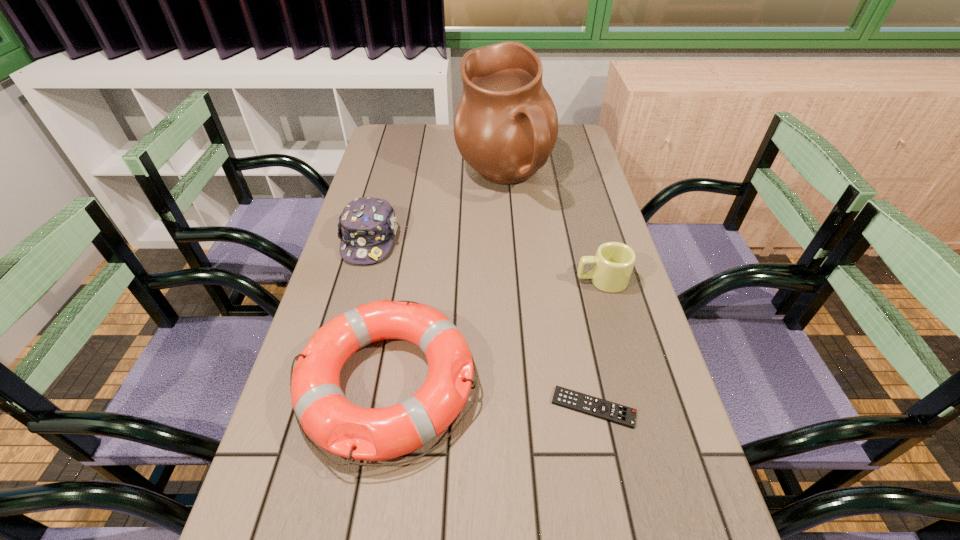
This screenshot has height=540, width=960. In order to click on vacant space that's between the life buoy and the mug in this screenshot , I will do `click(494, 332)`.

The image size is (960, 540). I want to click on vacant area that lies between the remote control and the life buoy, so click(x=490, y=395).

Find the location of a particular element. This screenshot has height=540, width=960. free spot between the mug and the headwear is located at coordinates (486, 260).

I want to click on blank region between the cream pitcher and the headwear, so click(437, 210).

Point out which object is positioned as the third nearest to the life buoy. Please provide its 2D coordinates. Your answer should be formatted as a tuple, i.e. [(x, y)], where the tuple contains the x and y coordinates of a point satisfying the conditions above.

[(613, 263)]

Locate which object ranks fourth in proximity to the headwear. Please provide its 2D coordinates. Your answer should be formatted as a tuple, i.e. [(x, y)], where the tuple contains the x and y coordinates of a point satisfying the conditions above.

[(570, 399)]

This screenshot has width=960, height=540. Identify the location of blank area in the image that satisfies the following two spatial constraints: 1. with the handle on the side of the third nearest object; 2. on the front side of the life buoy. (630, 383).

In order to click on vacant space that satisfies the following two spatial constraints: 1. at the spout of the tallest object; 2. on the right side of the shortest object in this screenshot , I will do `click(520, 407)`.

Where is `vacant space that satisfies the following two spatial constraints: 1. on the front-facing side of the headwear; 2. on the right side of the life buoy`? The image size is (960, 540). vacant space that satisfies the following two spatial constraints: 1. on the front-facing side of the headwear; 2. on the right side of the life buoy is located at coordinates (331, 383).

I want to click on vacant space that satisfies the following two spatial constraints: 1. on the front-facing side of the shortest object; 2. on the right side of the headwear, so click(x=324, y=407).